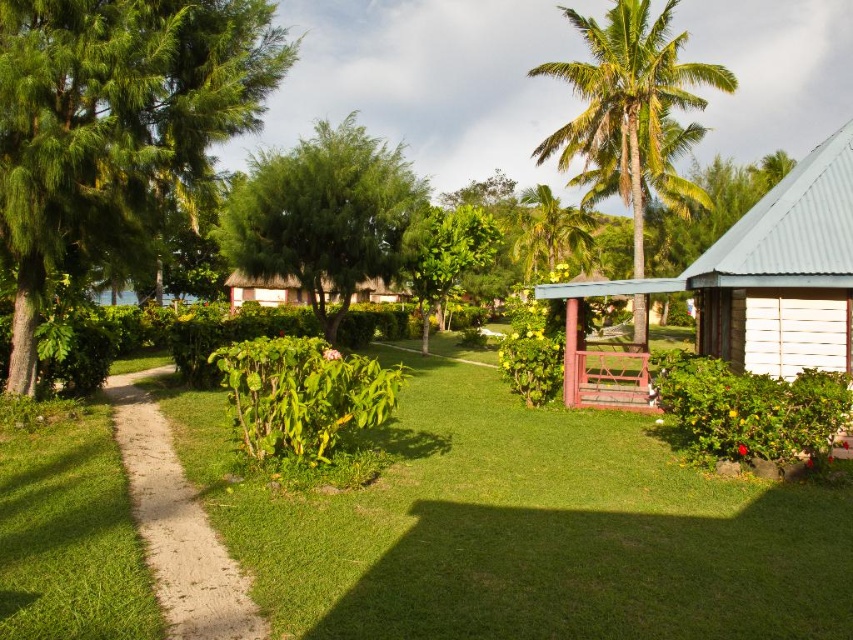
Is green leafy tree at left above green leafy tree at center?

Actually, green leafy tree at left is below green leafy tree at center.

Who is taller, green leafy tree at left or green leafy tree at center?

With more height is green leafy tree at center.

Where is `green leafy tree at left`? green leafy tree at left is located at coordinates (114, 128).

Who is more forward, (337, 269) or (225, 563)?

Point (225, 563) is in front.

Does point (332, 268) lie behind point (212, 541)?

Yes, point (332, 268) is farther from viewer.

Identify the location of green leafy tree at center. (322, 214).

Which of these two, white corrugated metal hut at right or dirt/gravel path at center, stands taller?

With more height is white corrugated metal hut at right.

Does white corrugated metal hut at right appear over dirt/gravel path at center?

Yes, white corrugated metal hut at right is above dirt/gravel path at center.

Does point (830, 273) lie behind point (158, 547)?

Yes, it is behind point (158, 547).

Where is `white corrugated metal hut at right`? This screenshot has width=853, height=640. white corrugated metal hut at right is located at coordinates (784, 273).